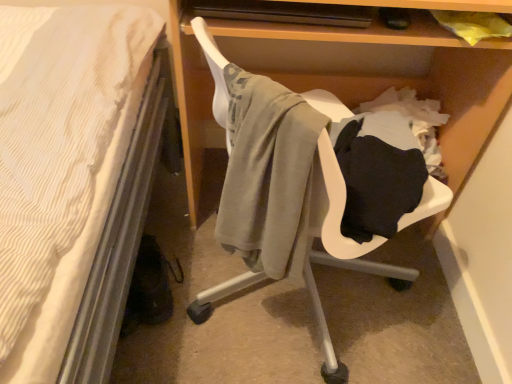
Question: From the image's perspective, is matte gray swivel chair at center positioned above or below wooden shelf at center?

Choices:
 (A) above
 (B) below

Answer: (B)

Question: From a real-world perspective, is matte gray swivel chair at center above or below wooden shelf at center?

Choices:
 (A) above
 (B) below

Answer: (A)

Question: In terms of height, does matte gray swivel chair at center look taller or shorter compared to wooden shelf at center?

Choices:
 (A) tall
 (B) short

Answer: (B)

Question: From a real-world perspective, is wooden shelf at center positioned above or below matte gray swivel chair at center?

Choices:
 (A) below
 (B) above

Answer: (A)

Question: Is wooden shelf at center taller or shorter than matte gray swivel chair at center?

Choices:
 (A) short
 (B) tall

Answer: (B)

Question: Looking at the image, does wooden shelf at center seem bigger or smaller compared to matte gray swivel chair at center?

Choices:
 (A) big
 (B) small

Answer: (A)

Question: In the image, is wooden shelf at center positioned in front of or behind matte gray swivel chair at center?

Choices:
 (A) behind
 (B) front

Answer: (A)